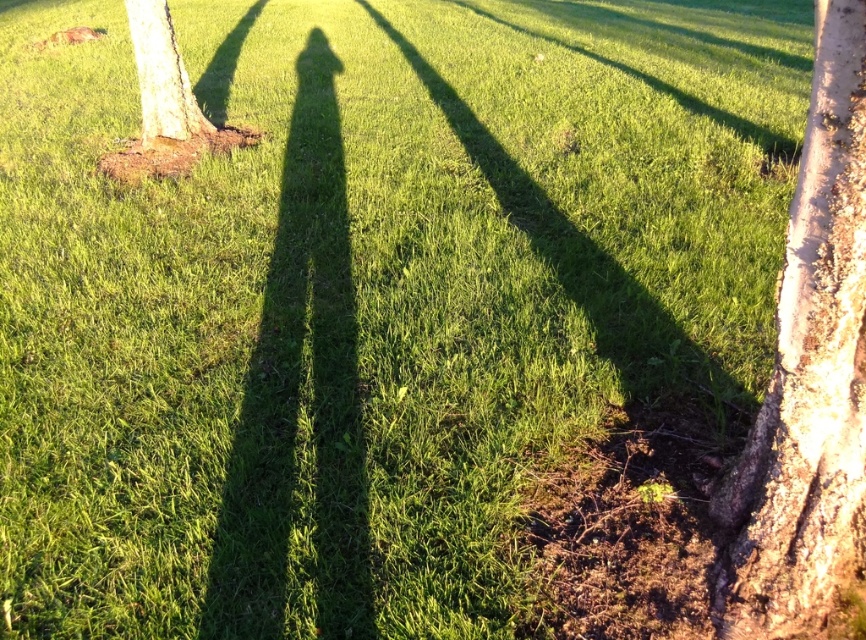
Question: Which point is farther from the camera taking this photo?

Choices:
 (A) (186, 106)
 (B) (816, 541)

Answer: (A)

Question: Is bark textured tree trunk at right bigger than smooth bark tree at left?

Choices:
 (A) yes
 (B) no

Answer: (B)

Question: Can you confirm if bark textured tree trunk at right is positioned below smooth bark tree at left?

Choices:
 (A) no
 (B) yes

Answer: (B)

Question: Which point is farther to the camera?

Choices:
 (A) bark textured tree trunk at right
 (B) smooth bark tree at left

Answer: (B)

Question: Does bark textured tree trunk at right come in front of smooth bark tree at left?

Choices:
 (A) yes
 (B) no

Answer: (A)